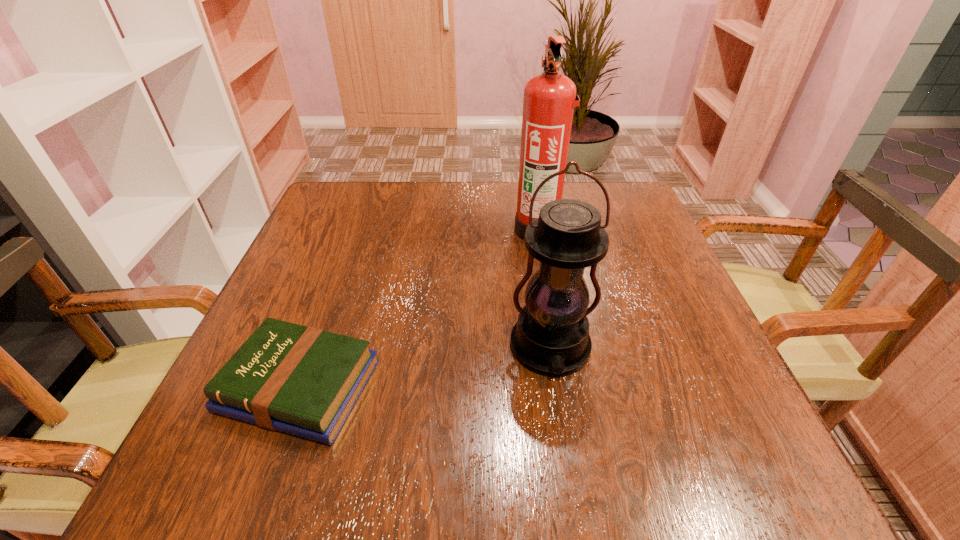
Where is `the tallest object`? This screenshot has height=540, width=960. the tallest object is located at coordinates (549, 98).

Locate an element on the screen. the farthest object is located at coordinates (549, 98).

What are the coordinates of `lantern` in the screenshot? It's located at (551, 337).

At what (x,y) coordinates should I click in order to perform the action: click on book. Please return your answer as a coordinate pair (x, y). Looking at the image, I should click on (304, 381).

Find the location of a particular element. the leftmost object is located at coordinates (304, 381).

You are a GUI agent. You are given a task and a screenshot of the screen. Output one action in this format:
    pyautogui.click(x=<x>, y=<y>)
    Task: Click on the free space located 0.140m with the nozzle pointing from the back of the farthest object
    The width and height of the screenshot is (960, 540).
    Given the screenshot: What is the action you would take?
    pyautogui.click(x=456, y=230)

At what (x,y) coordinates should I click in order to perform the action: click on free location located 0.110m with the nozzle pointing from the back of the farthest object. Please return your answer as a coordinate pair (x, y). Looking at the image, I should click on (468, 230).

At what (x,y) coordinates should I click in order to perform the action: click on vacant space located with the nozzle pointing from the back of the farthest object. Please return your answer as a coordinate pair (x, y). Looking at the image, I should click on (477, 230).

Pinpoint the vacant space located above the second tallest object, indicating its light source. Please provide its 2D coordinates. Your answer should be formatted as a tuple, i.e. [(x, y)], where the tuple contains the x and y coordinates of a point satisfying the conditions above.

[(561, 416)]

Locate an element on the screen. The width and height of the screenshot is (960, 540). blank area located 0.240m on the right of the shortest object is located at coordinates (519, 386).